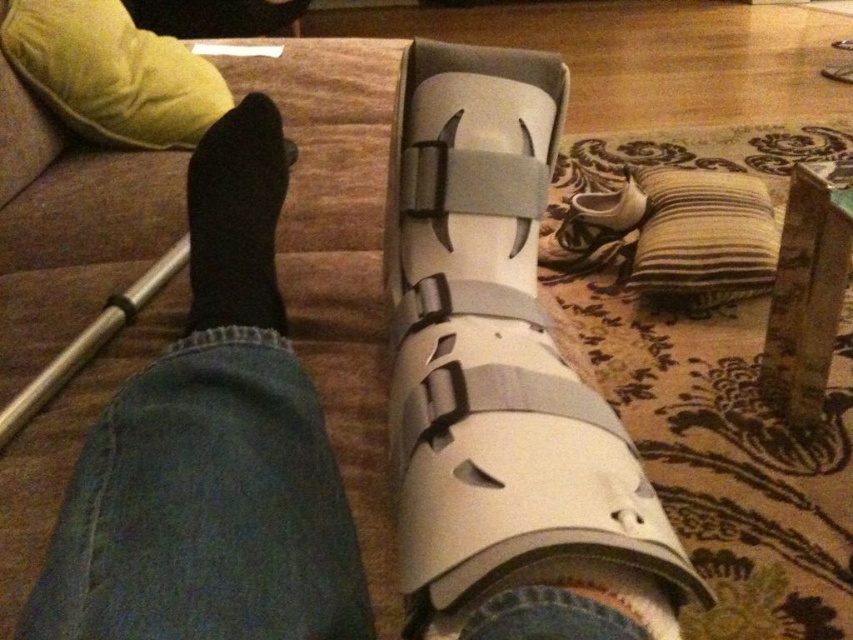
You are helping someone organize their living room. You see the black sock at left and the striped fabric pillow at lower right. Which item is positioned more to the left side of the room?

The black sock at left is positioned more to the left side of the room than the striped fabric pillow at lower right.

Based on the photo, you are a physical therapist assessing the positioning of the orthopedic boot on the patient. You notice two points marked on the boot at coordinates point (547,596) and point (123,115). Which point is closer to your viewpoint as you examine the boot?

Point (547,596) is closer to the viewer than point (123,115).

You are a physical therapist assessing a patient who has an injury. You see the white matte cast at center and the striped fabric pillow at lower right in the scene. Which object is higher in height?

The white matte cast at center is taller than the striped fabric pillow at lower right.